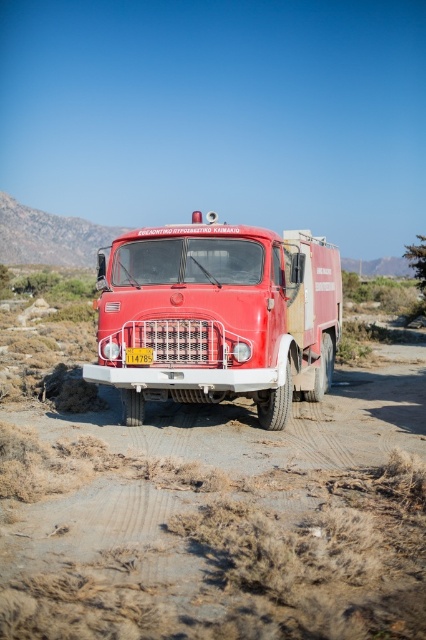
You are a drone operator tasked with capturing aerial footage of the shiny red fire truck at center. The drone is currently hovering at point A, which is at coordinates 0.3, 0.3. To get a clear shot, you need to position the drone directly above the fire truck. What direction should you move the drone to reach the fire truck?

→ The shiny red fire truck at center is located at point (x=218, y=316). Since the drone is at (x=127, y=192), it needs to move northeast to reach the fire truck.

You are a tourist in Greece and see the shiny red fire truck at center and the yellow metallic license plate at center. Which object is located more to the right?

The yellow metallic license plate at center is more to the right because the shiny red fire truck at center is positioned on the left side of it.